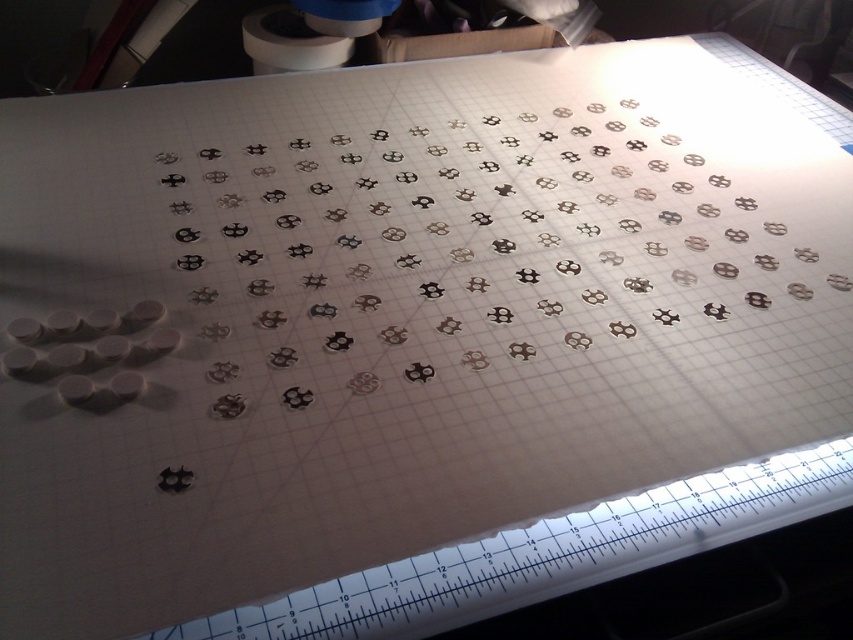
Can you confirm if white plastic ruler at bottom is taller than white matte toilet paper at upper center?

No, white plastic ruler at bottom is not taller than white matte toilet paper at upper center.

Which of these two, white plastic ruler at bottom or white matte toilet paper at upper center, stands taller?

white matte toilet paper at upper center

Image resolution: width=853 pixels, height=640 pixels. In order to click on white plastic ruler at bottom in this screenshot , I will do `click(547, 554)`.